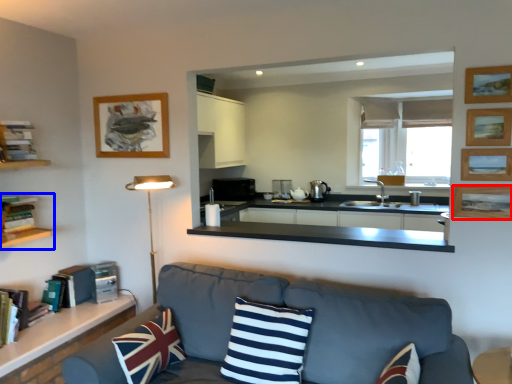
Question: Which point is closer to the camera, picture frame (highlighted by a red box) or shelf (highlighted by a blue box)?

Choices:
 (A) picture frame
 (B) shelf

Answer: (A)